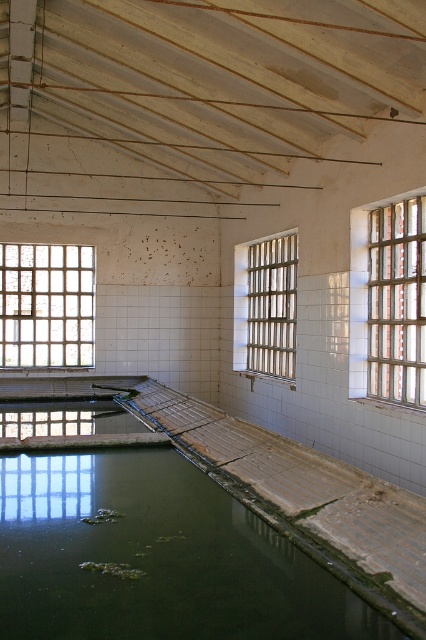
Between green algae at lower left and metallic bars at center, which one has more height?

Standing taller between the two is metallic bars at center.

Between point (365, 636) and point (255, 280), which one is positioned in front?

Point (365, 636)

Identify the location of green algae at lower left. Image resolution: width=426 pixels, height=640 pixels. (155, 557).

Where is `clear glass window at left`? Image resolution: width=426 pixels, height=640 pixels. clear glass window at left is located at coordinates (46, 305).

Does clear glass window at left have a larger size compared to metallic bars at center?

Yes, clear glass window at left is bigger than metallic bars at center.

Where is `clear glass window at left`? This screenshot has width=426, height=640. clear glass window at left is located at coordinates (46, 305).

Is green algae at lower left smaller than clear glass window at left?

Indeed, green algae at lower left has a smaller size compared to clear glass window at left.

Does green algae at lower left appear on the left side of clear glass window at left?

Incorrect, green algae at lower left is not on the left side of clear glass window at left.

Does point (215, 604) lie behind point (29, 316)?

No.

Locate an element on the screen. This screenshot has height=640, width=426. green algae at lower left is located at coordinates (155, 557).